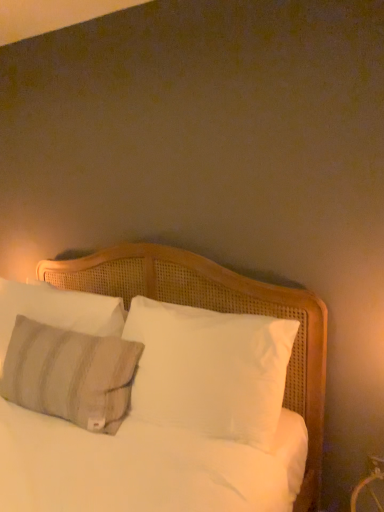
In order to face textured gray pillow at left, which is counted as the second pillow, starting from the front, should I rotate leftwards or rightwards?

To face it directly, rotate left by 19.009 degrees.

Identify the location of textured gray pillow at left, marked as the second pillow in a back-to-front arrangement. The width and height of the screenshot is (384, 512). (70, 374).

How distant is textured gray pillow at left, the 1th pillow from the front, from white woven bed at center?

They are 18.87 inches apart.

Where is `the 1st pillow behind the white woven bed at center, starting your count from the anchor`? The image size is (384, 512). the 1st pillow behind the white woven bed at center, starting your count from the anchor is located at coordinates (70, 374).

What's the angular difference between textured gray pillow at left, marked as the second pillow in a back-to-front arrangement, and white woven bed at center's facing directions?

textured gray pillow at left, marked as the second pillow in a back-to-front arrangement, and white woven bed at center are facing 5.59 degrees away from each other.

From the image's perspective, would you say textured gray pillow at left, marked as the second pillow in a back-to-front arrangement, is shown under white woven bed at center?

Yes, from the image's perspective, textured gray pillow at left, marked as the second pillow in a back-to-front arrangement, is beneath white woven bed at center.

Considering the sizes of textured gray pillow at left, marked as the second pillow in a back-to-front arrangement, and textured gray pillow at left, which is the 1th pillow from back to front, in the image, is textured gray pillow at left, marked as the second pillow in a back-to-front arrangement, taller or shorter than textured gray pillow at left, which is the 1th pillow from back to front,?

textured gray pillow at left, marked as the second pillow in a back-to-front arrangement, is taller than textured gray pillow at left, which is the 1th pillow from back to front.

Which object is closer to the camera, textured gray pillow at left, marked as the second pillow in a back-to-front arrangement, or textured gray pillow at left, which is counted as the second pillow, starting from the front?

textured gray pillow at left, marked as the second pillow in a back-to-front arrangement.

Between textured gray pillow at left, marked as the second pillow in a back-to-front arrangement, and textured gray pillow at left, which is counted as the second pillow, starting from the front, which one has smaller width?

textured gray pillow at left, which is counted as the second pillow, starting from the front, is thinner.

What's the angular difference between textured gray pillow at left, which is counted as the second pillow, starting from the front, and white woven bed at center's facing directions?

3.15 degrees.

At what (x,y) coordinates should I click in order to perform the action: click on pillow that is the 2nd object located behind the white woven bed at center. Please return your answer as a coordinate pair (x, y). Looking at the image, I should click on (57, 311).

From a real-world perspective, is textured gray pillow at left, which is counted as the second pillow, starting from the front, on top of white woven bed at center?

Yes.

Considering the positions of objects textured gray pillow at left, which is the 1th pillow from back to front, and white woven bed at center in the image provided, who is in front, textured gray pillow at left, which is the 1th pillow from back to front, or white woven bed at center?

Positioned in front is white woven bed at center.

At what (x,y) coordinates should I click in order to perform the action: click on pillow lying above the textured gray pillow at left, the 1th pillow from the front (from the image's perspective). Please return your answer as a coordinate pair (x, y). This screenshot has width=384, height=512. Looking at the image, I should click on (57, 311).

Which object is wider, textured gray pillow at left, which is the 1th pillow from back to front, or textured gray pillow at left, marked as the second pillow in a back-to-front arrangement?

textured gray pillow at left, marked as the second pillow in a back-to-front arrangement, is wider.

Based on their sizes in the image, would you say textured gray pillow at left, which is counted as the second pillow, starting from the front, is bigger or smaller than textured gray pillow at left, the 1th pillow from the front?

In the image, textured gray pillow at left, which is counted as the second pillow, starting from the front, appears to be smaller than textured gray pillow at left, the 1th pillow from the front.

Considering the positions of objects white woven bed at center and textured gray pillow at left, which is counted as the second pillow, starting from the front, in the image provided, who is in front, white woven bed at center or textured gray pillow at left, which is counted as the second pillow, starting from the front,?

white woven bed at center is in front.

Locate an element on the screen. the 2nd pillow behind the white woven bed at center, counting from the anchor's position is located at coordinates (57, 311).

From a real-world perspective, is white woven bed at center physically above textured gray pillow at left, which is counted as the second pillow, starting from the front?

No, from a real-world perspective, white woven bed at center is not over textured gray pillow at left, which is counted as the second pillow, starting from the front

Is white woven bed at center completely or partially outside of textured gray pillow at left, the 1th pillow from the front?

white woven bed at center lies outside textured gray pillow at left, the 1th pillow from the front,'s area.

Does white woven bed at center lie behind textured gray pillow at left, the 1th pillow from the front?

No, the depth of white woven bed at center is less than that of textured gray pillow at left, the 1th pillow from the front.

Considering the sizes of objects white woven bed at center and textured gray pillow at left, marked as the second pillow in a back-to-front arrangement, in the image provided, who is smaller, white woven bed at center or textured gray pillow at left, marked as the second pillow in a back-to-front arrangement,?

textured gray pillow at left, marked as the second pillow in a back-to-front arrangement.

From the image's perspective, which one is positioned higher, white woven bed at center or textured gray pillow at left, marked as the second pillow in a back-to-front arrangement?

white woven bed at center is shown above in the image.

What are the coordinates of `bed on the right side of textured gray pillow at left, marked as the second pillow in a back-to-front arrangement` in the screenshot? It's located at (219, 311).

At what (x,y) coordinates should I click in order to perform the action: click on pillow below the textured gray pillow at left, which is counted as the second pillow, starting from the front (from the image's perspective). Please return your answer as a coordinate pair (x, y). The height and width of the screenshot is (512, 384). Looking at the image, I should click on (70, 374).

Looking at the image, which one is located closer to textured gray pillow at left, which is the 1th pillow from back to front, textured gray pillow at left, the 1th pillow from the front, or white woven bed at center?

textured gray pillow at left, the 1th pillow from the front, lies closer to textured gray pillow at left, which is the 1th pillow from back to front, than the other object.

Considering their positions, is white woven bed at center positioned further to textured gray pillow at left, the 1th pillow from the front, than textured gray pillow at left, which is counted as the second pillow, starting from the front?

white woven bed at center lies further to textured gray pillow at left, the 1th pillow from the front, than the other object.

Estimate the real-world distances between objects in this image. Which object is closer to textured gray pillow at left, which is the 1th pillow from back to front, white woven bed at center or textured gray pillow at left, marked as the second pillow in a back-to-front arrangement?

textured gray pillow at left, marked as the second pillow in a back-to-front arrangement, is closer to textured gray pillow at left, which is the 1th pillow from back to front.

From the image, which object appears to be farther from white woven bed at center, textured gray pillow at left, the 1th pillow from the front, or textured gray pillow at left, which is counted as the second pillow, starting from the front?

Among the two, textured gray pillow at left, the 1th pillow from the front, is located further to white woven bed at center.

From the image, which object appears to be farther from textured gray pillow at left, the 1th pillow from the front, textured gray pillow at left, which is the 1th pillow from back to front, or white woven bed at center?

white woven bed at center is positioned further to the anchor textured gray pillow at left, the 1th pillow from the front.

Considering their positions, is textured gray pillow at left, which is the 1th pillow from back to front, positioned closer to white woven bed at center than textured gray pillow at left, the 1th pillow from the front?

Among the two, textured gray pillow at left, which is the 1th pillow from back to front, is located nearer to white woven bed at center.

Identify the location of pillow located between textured gray pillow at left, which is the 1th pillow from back to front, and white woven bed at center in the left-right direction. (70, 374).